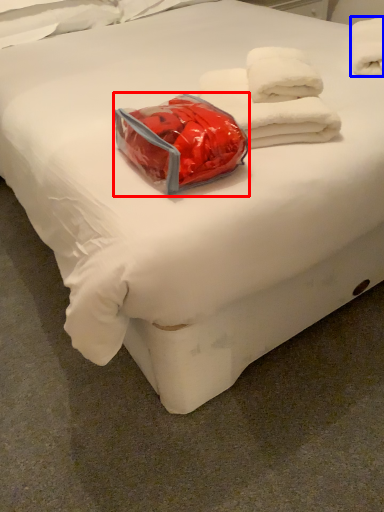
Question: Which object appears farthest to the camera in this image, package (highlighted by a red box) or towel (highlighted by a blue box)?

Choices:
 (A) package
 (B) towel

Answer: (B)